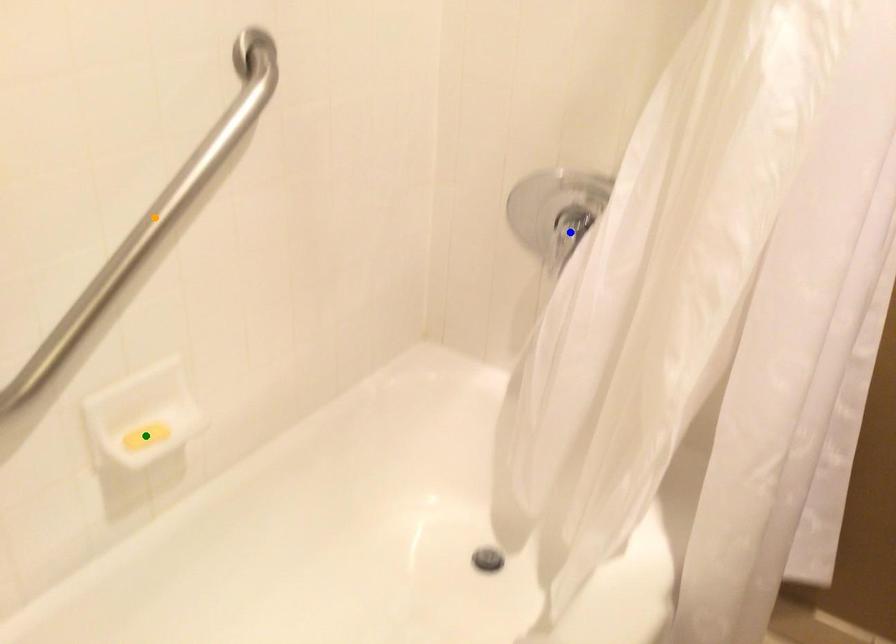
Order these from farthest to nearest:
green point | blue point | orange point

blue point, green point, orange point